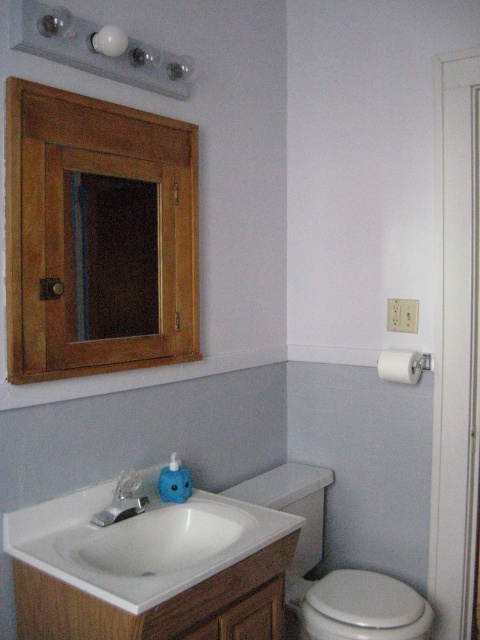
You are standing in the bathroom and want to place a small decorative item on the wall. There are two points marked on the wall where you can place it. The first point is at coordinates point (40,196) and the second is at point (130,486). Which point is closer to you?

Point (40,196) is in front of point (130,486), so placing the decorative item there would be closer to you.

You are standing in a bathroom and want to reach the wooden medicine cabinet at upper left. If your arm can extend 3 feet, can you reach it?

The wooden medicine cabinet at upper left is 4.71 feet away from the viewer, which is beyond the arm extension of 3 feet. Therefore, you cannot reach it.

You are a contractor measuring the bathroom for new fixtures. You need to know which object is taller between the wooden frame at upper left and the white glossy toilet at lower right. Based on the scene, can you determine which one is taller?

The wooden frame at upper left is much taller than the white glossy toilet at lower right according to the description.